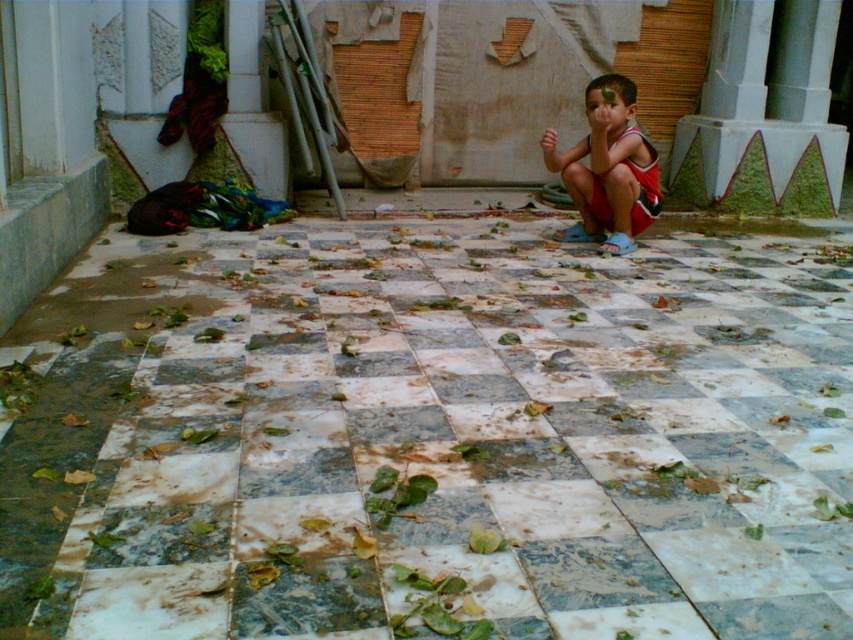
Question: Which point appears farthest from the camera in this image?

Choices:
 (A) (625, 118)
 (B) (213, 435)

Answer: (A)

Question: Can you confirm if marble tile at center is thinner than reddish-brown fabric shorts at center?

Choices:
 (A) no
 (B) yes

Answer: (A)

Question: Can you confirm if marble tile at center is bigger than reddish-brown fabric shorts at center?

Choices:
 (A) yes
 (B) no

Answer: (A)

Question: Is marble tile at center below reddish-brown fabric shorts at center?

Choices:
 (A) yes
 (B) no

Answer: (A)